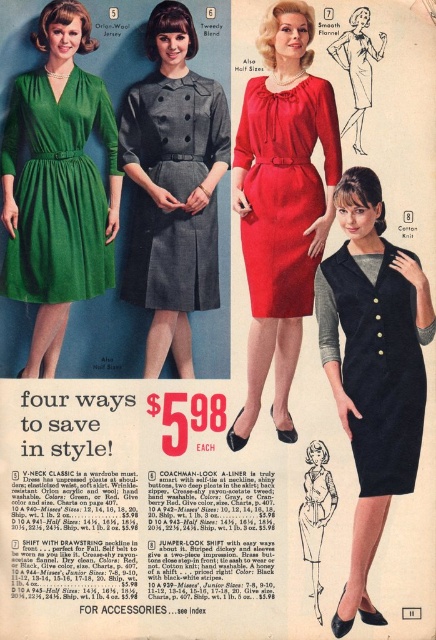
Is green wool jersey dress at left closer to camera compared to black wool dress at center?

That is True.

Does green wool jersey dress at left come behind black wool dress at center?

No, it is in front of black wool dress at center.

Does point (57, 145) come behind point (313, 481)?

That is False.

The height and width of the screenshot is (640, 436). In order to click on green wool jersey dress at left in this screenshot , I will do `click(57, 189)`.

In the scene shown: Can you confirm if twilly blend wool dress at center is positioned below velvet navy dress at center?

No, twilly blend wool dress at center is not below velvet navy dress at center.

Between twilly blend wool dress at center and velvet navy dress at center, which one has more height?

With more height is twilly blend wool dress at center.

The height and width of the screenshot is (640, 436). I want to click on twilly blend wool dress at center, so (173, 186).

Where is `twilly blend wool dress at center`? The height and width of the screenshot is (640, 436). twilly blend wool dress at center is located at coordinates (173, 186).

Does smooth flannel dress at center appear under velvet navy dress at center?

Incorrect, smooth flannel dress at center is not positioned below velvet navy dress at center.

Between point (314, 102) and point (361, 369), which one is positioned behind?

Positioned behind is point (361, 369).

Identify the location of smooth flannel dress at center. (282, 204).